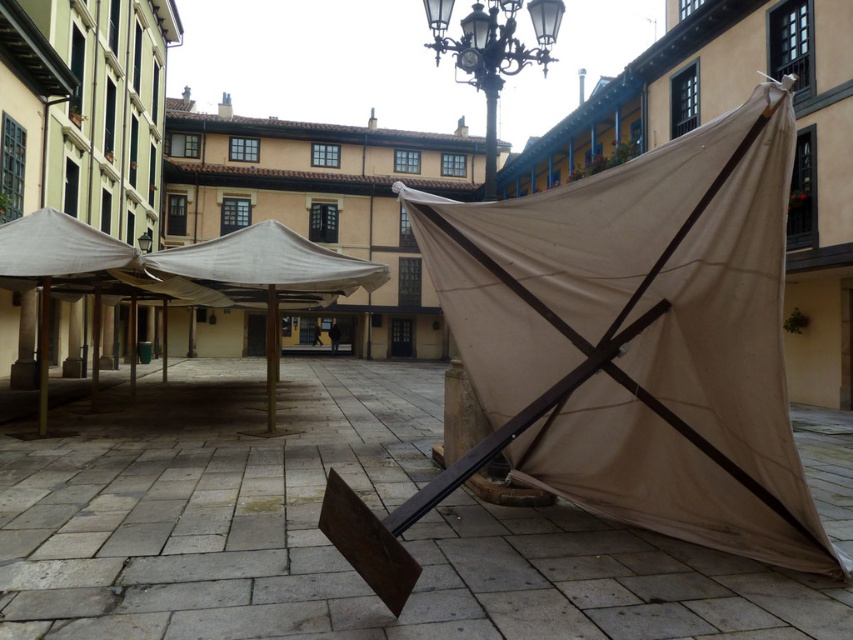
You are standing at the center of the courtyard and want to place a new bench exactly at the coordinates given for the white fabric umbrella at center. Is this possible?

The white fabric umbrella at center is already positioned at point (260,278), so placing a bench there would require removing the umbrella first.